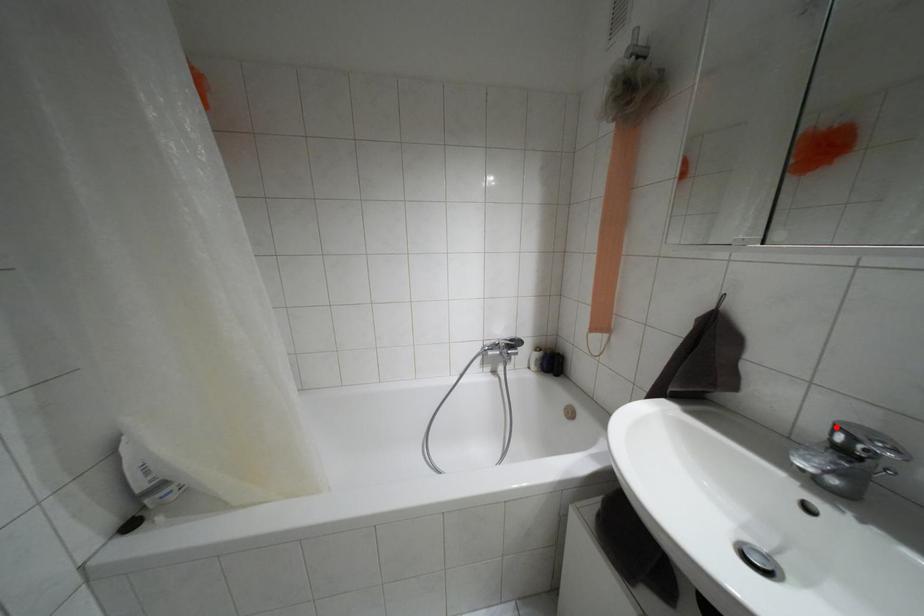
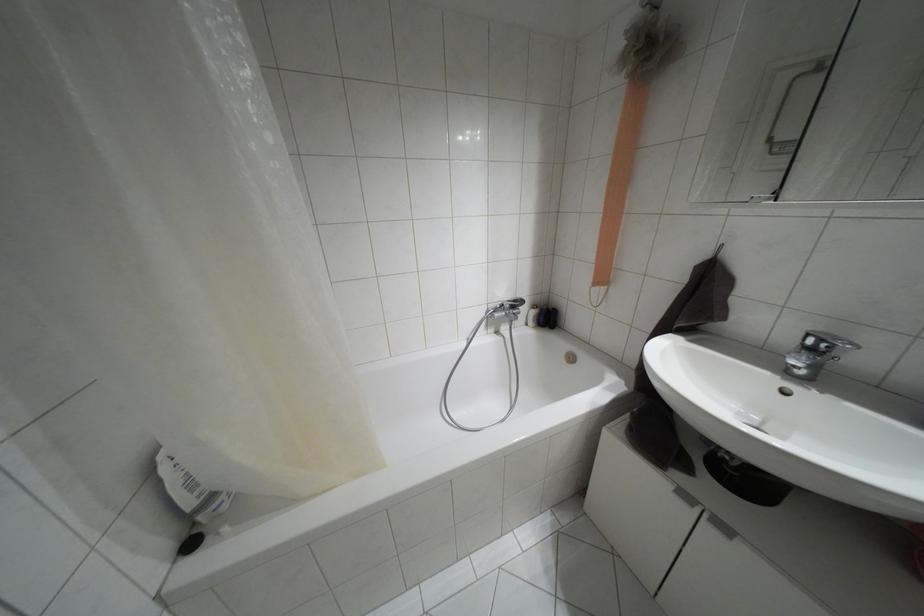
Find the pixel in the second image that matches the highlighted location in the first image.

(808, 334)